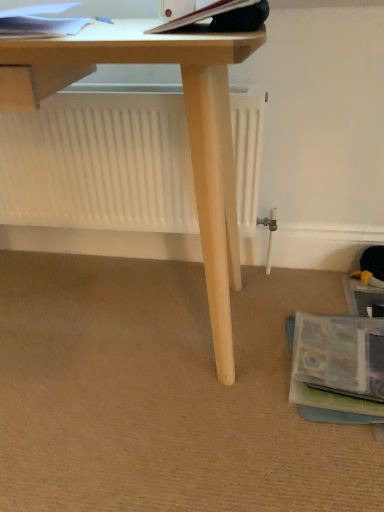
Question: Is hardcover book at upper center, the second paperback book when ordered from left to right, to the left or to the right of matte paper at upper left, placed as the second paperback book when sorted from right to left, in the image?

Choices:
 (A) right
 (B) left

Answer: (A)

Question: Considering their positions, is hardcover book at upper center, marked as the 1th paperback book in a right-to-left arrangement, located in front of or behind matte paper at upper left, marked as the 1th paperback book in a left-to-right arrangement?

Choices:
 (A) front
 (B) behind

Answer: (A)

Question: Choose the correct answer: Is hardcover book at upper center, the second paperback book when ordered from left to right, inside matte paper at upper left, placed as the second paperback book when sorted from right to left, or outside it?

Choices:
 (A) outside
 (B) inside

Answer: (A)

Question: Is matte paper at upper left, placed as the second paperback book when sorted from right to left, bigger or smaller than hardcover book at upper center, marked as the 1th paperback book in a right-to-left arrangement?

Choices:
 (A) small
 (B) big

Answer: (B)

Question: Is matte paper at upper left, placed as the second paperback book when sorted from right to left, wider or thinner than hardcover book at upper center, marked as the 1th paperback book in a right-to-left arrangement?

Choices:
 (A) wide
 (B) thin

Answer: (A)

Question: In terms of height, does matte paper at upper left, marked as the 1th paperback book in a left-to-right arrangement, look taller or shorter compared to hardcover book at upper center, marked as the 1th paperback book in a right-to-left arrangement?

Choices:
 (A) tall
 (B) short

Answer: (B)

Question: Based on their positions, is matte paper at upper left, placed as the second paperback book when sorted from right to left, located to the left or right of hardcover book at upper center, marked as the 1th paperback book in a right-to-left arrangement?

Choices:
 (A) right
 (B) left

Answer: (B)